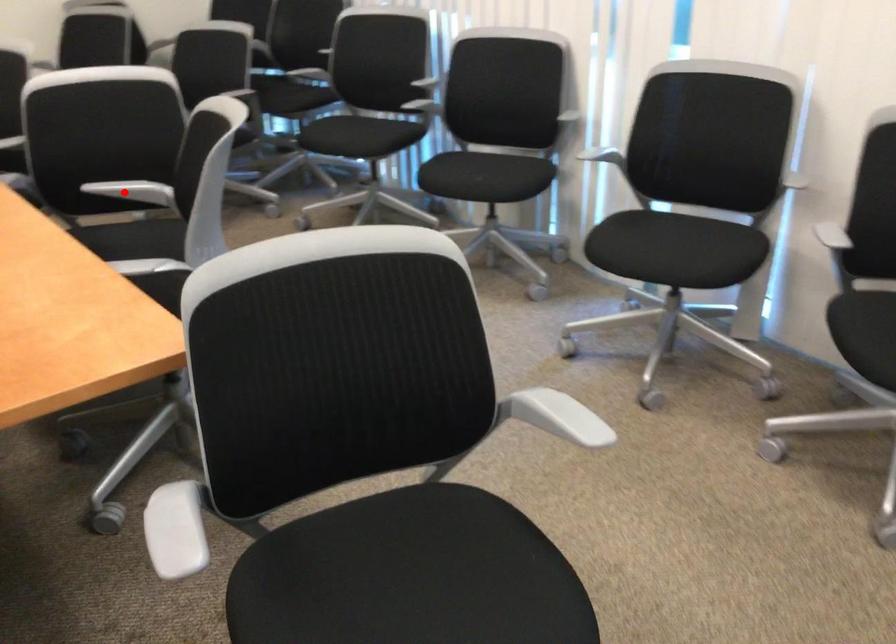
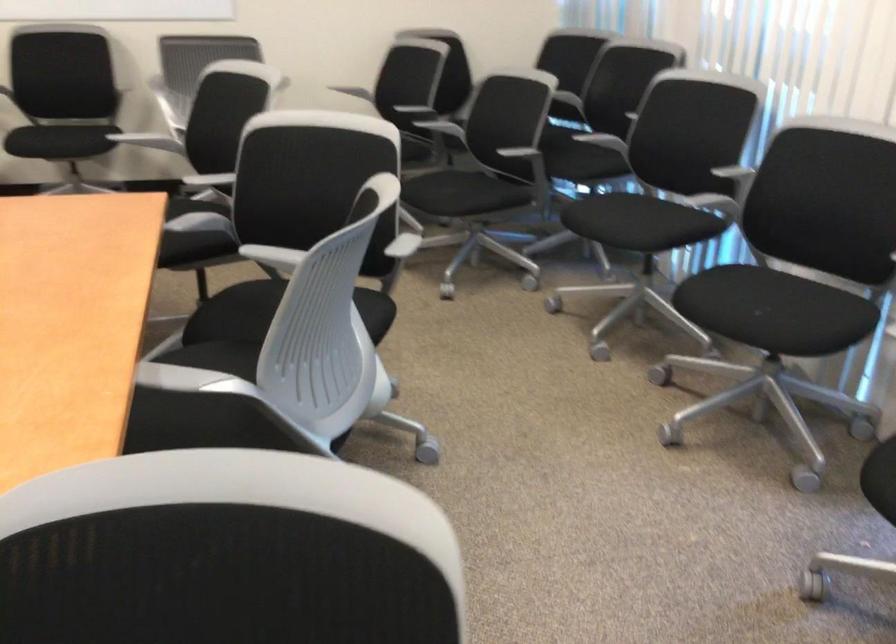
Locate, in the second image, the point that corresponds to the highlighted location in the first image.

(273, 258)